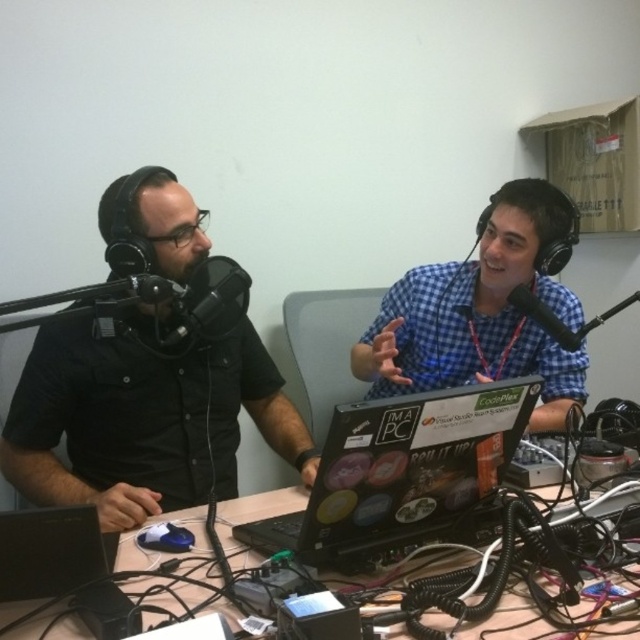
You are a photographer trying to capture a closeup shot of the person on the right. You have a camera with a focal length of 50mm. To ensure both points are in focus, should you focus on point A at position (196, 369) or point B at position (244, 564)?

You should focus on point A at position (196, 369) because it is closer to the viewer than point B at position (244, 564). This will ensure both points are within the depth of field.

You are trying to set up a new microphone stand for the podcast recording. The shiny black laptop at center is in the way. Can you place the microphone stand to the left or right of the laptop without moving it?

The shiny black laptop at center is located at point (400, 474). Since the laptop is at the center, you can place the microphone stand either to the left or right of it without moving the laptop.